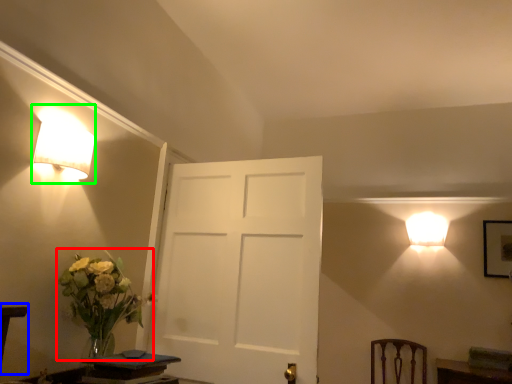
Question: Which is farther away from floral arrangement (highlighted by a red box)? table (highlighted by a blue box) or lamp (highlighted by a green box)?

Choices:
 (A) table
 (B) lamp

Answer: (B)